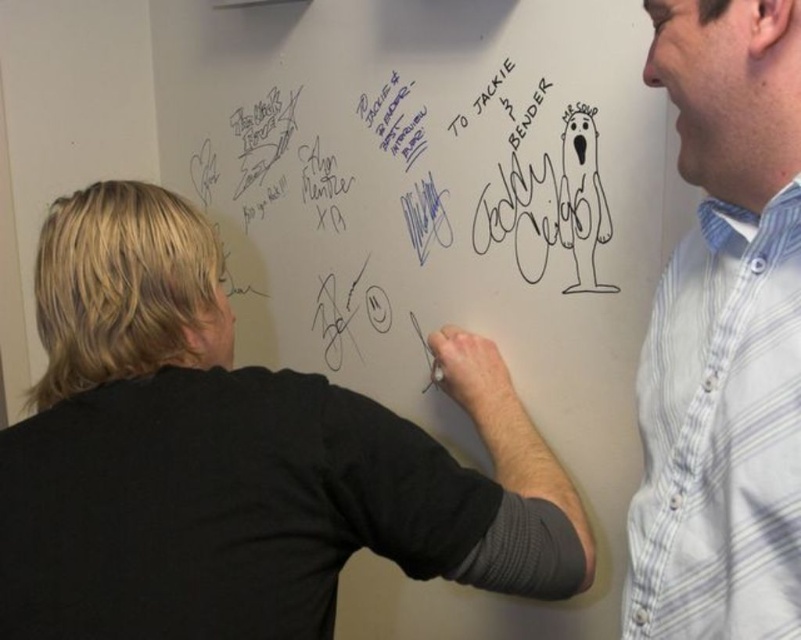
Question: Which point is closer to the camera?

Choices:
 (A) (731, 365)
 (B) (7, 460)

Answer: (A)

Question: Does black shirt at left appear on the left side of black marker writing at upper center?

Choices:
 (A) no
 (B) yes

Answer: (B)

Question: Can you confirm if black marker writing at upper center is wider than white striped shirt at upper right?

Choices:
 (A) yes
 (B) no

Answer: (A)

Question: Which point is farther from the camera taking this photo?

Choices:
 (A) (133, 348)
 (B) (566, 205)

Answer: (B)

Question: Can you confirm if black shirt at left is bigger than black marker writing at upper center?

Choices:
 (A) yes
 (B) no

Answer: (B)

Question: Which of the following is the farthest from the observer?

Choices:
 (A) black marker writing at upper center
 (B) white striped shirt at upper right

Answer: (A)